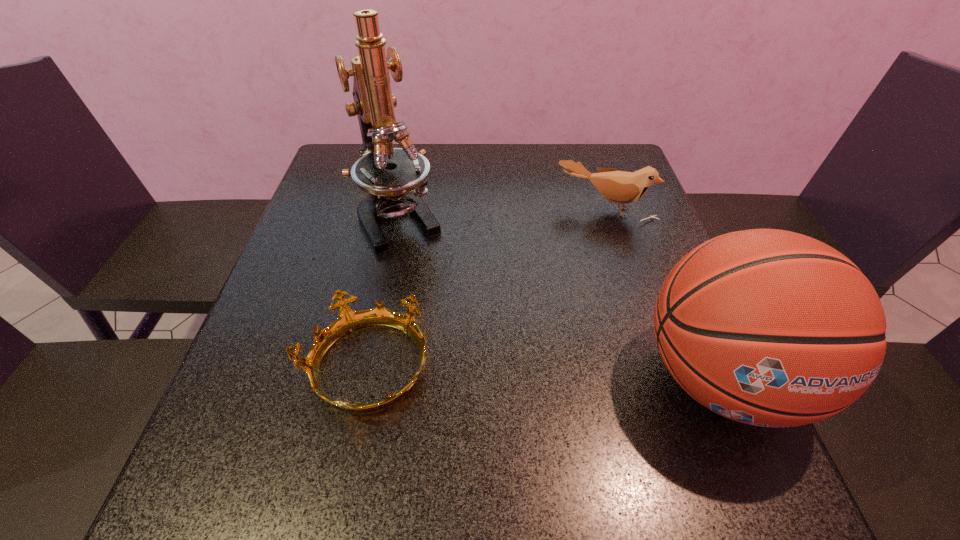
Where is `object located in the near right corner section of the desktop`? Image resolution: width=960 pixels, height=540 pixels. object located in the near right corner section of the desktop is located at coordinates (767, 327).

At what (x,y) coordinates should I click in order to perform the action: click on vacant area at the far edge of the desktop. Please return your answer as a coordinate pair (x, y). This screenshot has width=960, height=540. Looking at the image, I should click on 470,178.

Where is `free region at the near edge of the desktop`? This screenshot has width=960, height=540. free region at the near edge of the desktop is located at coordinates click(516, 399).

You are a GUI agent. You are given a task and a screenshot of the screen. Output one action in this format:
    pyautogui.click(x=<x>, y=<y>)
    Task: Click on the vacant area at the left edge
    
    Given the screenshot: What is the action you would take?
    (265, 349)

Identify the location of vacant space at the right edge. The height and width of the screenshot is (540, 960). (613, 238).

Locate an element on the screen. vacant space at the near right corner of the desktop is located at coordinates (650, 407).

This screenshot has width=960, height=540. I want to click on free space between the microscope and the third tallest object, so click(503, 212).

At what (x,y) coordinates should I click in order to perform the action: click on free space between the second tallest object and the shortest object. Please return your answer as a coordinate pair (x, y). The height and width of the screenshot is (540, 960). Looking at the image, I should click on (544, 373).

I want to click on vacant point located between the microscope and the shortest object, so click(385, 292).

Find the location of a particular element. free space between the microscope and the bird is located at coordinates (503, 212).